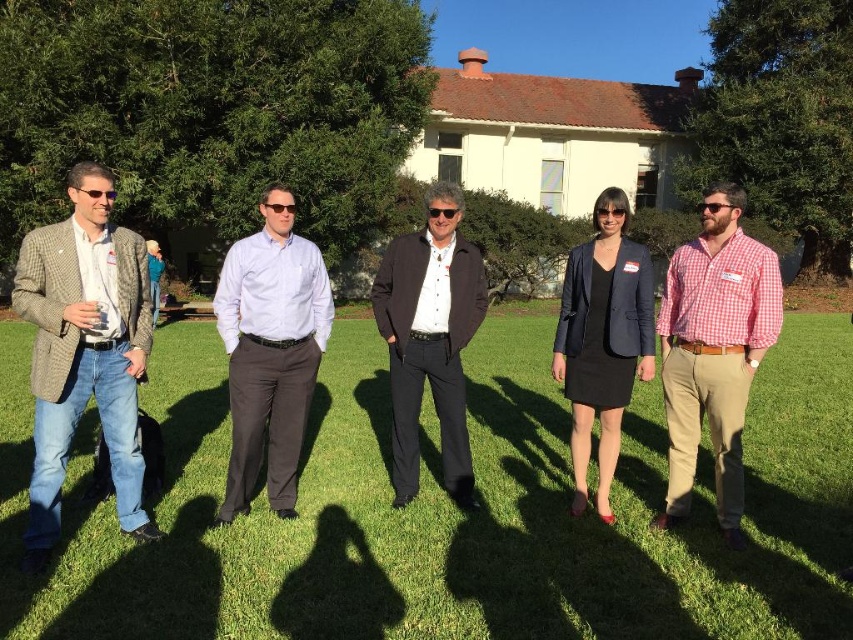
Can you confirm if matte black pants at center is shorter than dark brown leather jacket at center?

Indeed, matte black pants at center has a lesser height compared to dark brown leather jacket at center.

Between point (248, 636) and point (389, 368), which one is positioned behind?

The point (389, 368) is more distant.

Does point (822, 548) come in front of point (440, 237)?

Yes, it is.

This screenshot has height=640, width=853. I want to click on matte black pants at center, so click(x=448, y=509).

Can you confirm if dark brown leather jacket at center is positioned above navy blue fabric business suit at center?

No.

Between dark brown leather jacket at center and navy blue fabric business suit at center, which one appears on the left side from the viewer's perspective?

From the viewer's perspective, dark brown leather jacket at center appears more on the left side.

Looking at this image, who is more forward, (409, 257) or (634, 301)?

Point (634, 301) is more forward.

You are a GUI agent. You are given a task and a screenshot of the screen. Output one action in this format:
    pyautogui.click(x=<x>, y=<y>)
    Task: Click on the dark brown leather jacket at center
    This screenshot has height=640, width=853.
    Given the screenshot: What is the action you would take?
    pyautogui.click(x=428, y=340)

Does matte black pants at center have a lesser width compared to glossy plastic sunglasses at center?

No.

Does matte black pants at center have a larger size compared to glossy plastic sunglasses at center?

Correct, matte black pants at center is larger in size than glossy plastic sunglasses at center.

Measure the distance between point (19, 508) and camera.

15.06 feet

Identify the location of matte black pants at center. The height and width of the screenshot is (640, 853). (448, 509).